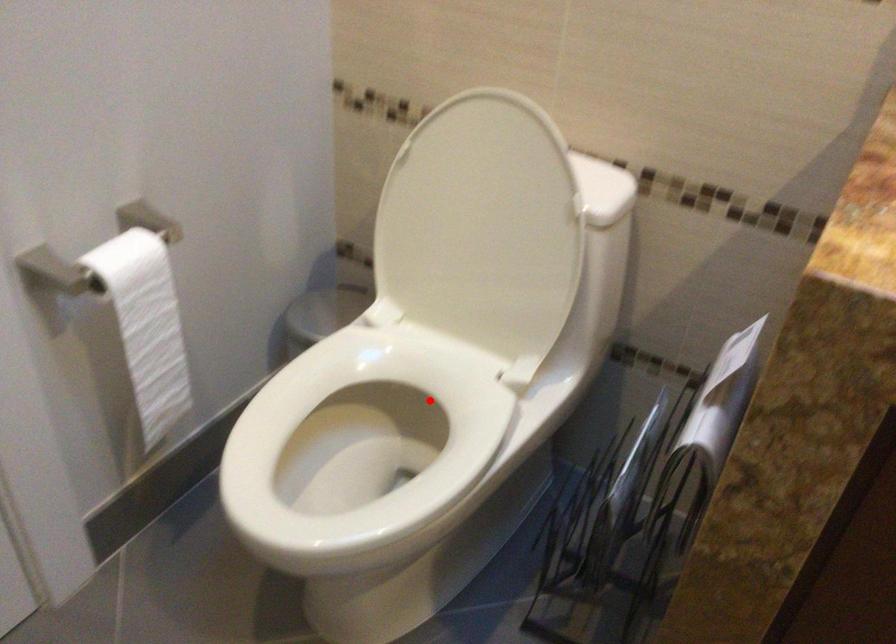
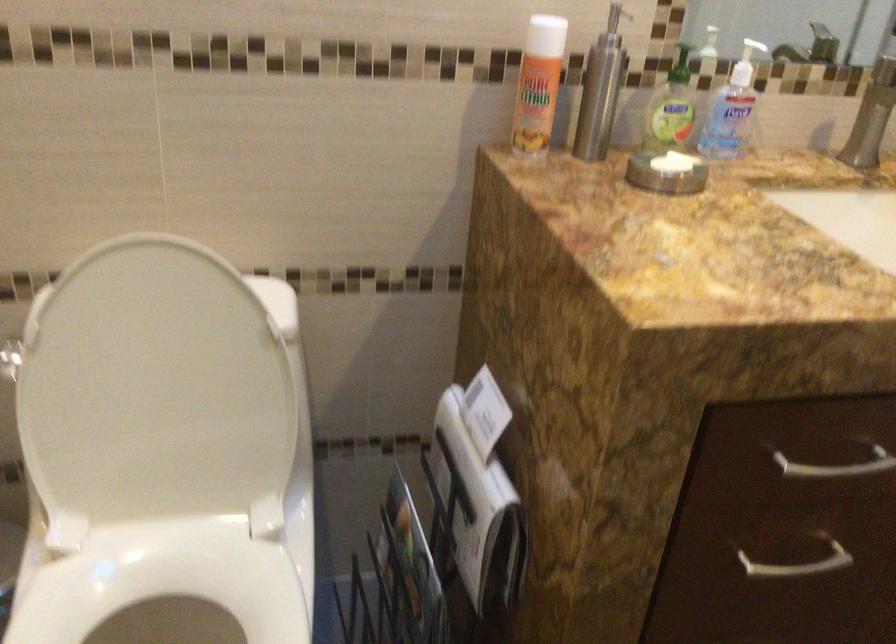
The point at the highlighted location is marked in the first image. Where is the corresponding point in the second image?

(166, 594)